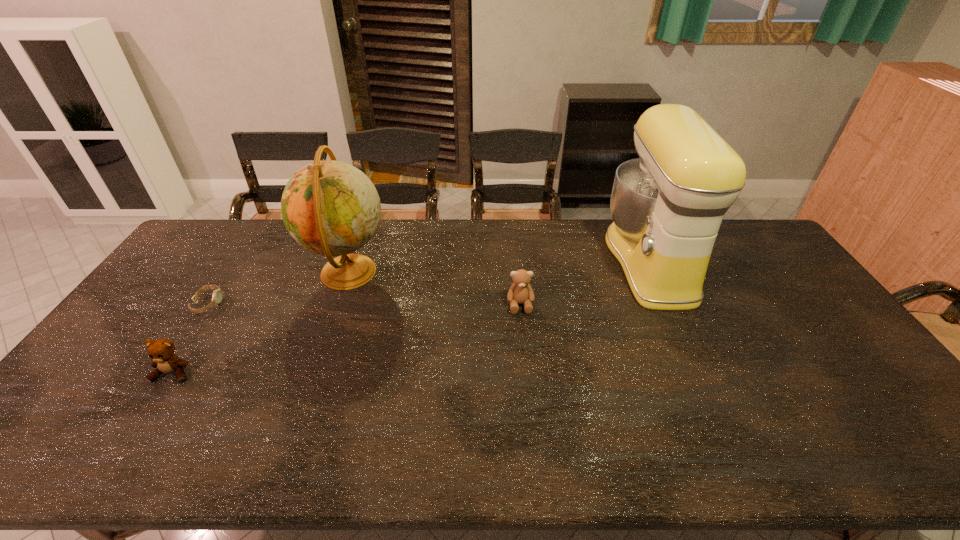
This screenshot has height=540, width=960. Find the location of `mixer`. mixer is located at coordinates (667, 206).

This screenshot has width=960, height=540. I want to click on globe, so click(331, 208).

At what (x,y) coordinates should I click in order to perform the action: click on the farther teddy bear. Please return your answer as a coordinate pair (x, y). The width and height of the screenshot is (960, 540). Looking at the image, I should click on (520, 292).

Image resolution: width=960 pixels, height=540 pixels. In order to click on the right teddy bear in this screenshot , I will do `click(520, 292)`.

What are the coordinates of `the left teddy bear` in the screenshot? It's located at (161, 351).

Identify the location of the nearer teddy bear. (161, 351).

You are a GUI agent. You are given a task and a screenshot of the screen. Output one action in this format:
    pyautogui.click(x=<x>, y=<y>)
    Task: Click on the watch
    
    Given the screenshot: What is the action you would take?
    pyautogui.click(x=217, y=294)

Where is `vacant area located 0.060m on the side of the rightmost object with the control knob`? vacant area located 0.060m on the side of the rightmost object with the control knob is located at coordinates (x=590, y=262).

The height and width of the screenshot is (540, 960). In order to click on vacant space located 0.330m on the side of the rightmost object with the control knob in this screenshot , I will do `click(512, 262)`.

Where is `free space located on the side of the rightmost object with the control knob`? The image size is (960, 540). free space located on the side of the rightmost object with the control knob is located at coordinates (585, 262).